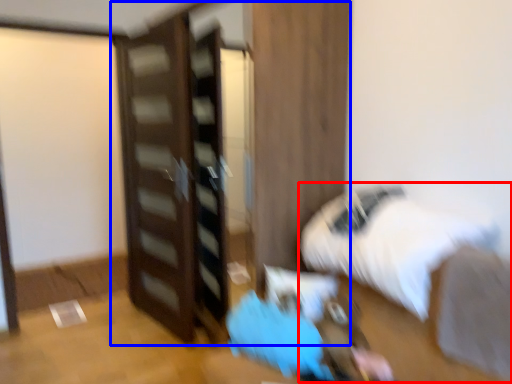
Question: Which object appears closest to the camera in this image, bed (highlighted by a red box) or dresser (highlighted by a blue box)?

Choices:
 (A) bed
 (B) dresser

Answer: (A)